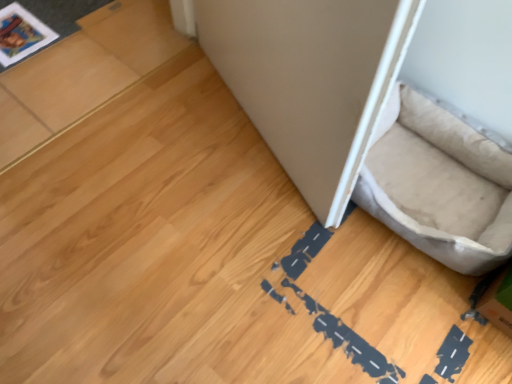
Locate an element on the screen. beige fabric dog bed at lower right is located at coordinates (439, 185).

What do you see at coordinates (439, 185) in the screenshot? This screenshot has width=512, height=384. I see `beige fabric dog bed at lower right` at bounding box center [439, 185].

Find the location of a particular element. Image resolution: width=512 pixels, height=384 pixels. beige fabric dog bed at lower right is located at coordinates (439, 185).